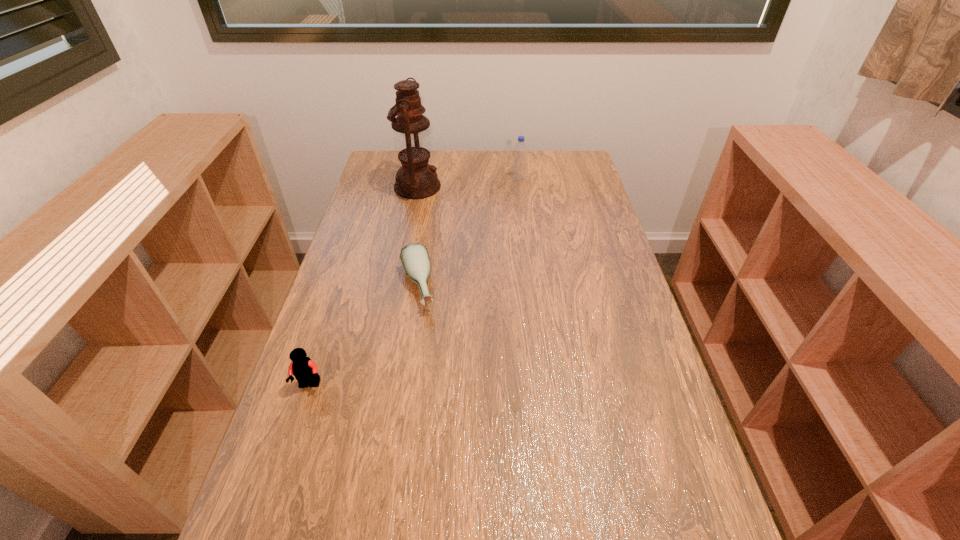
Where is `free space that satisfies the following two spatial constraints: 1. on the back side of the left bottle; 2. on the left side of the third shortest object`? This screenshot has height=540, width=960. free space that satisfies the following two spatial constraints: 1. on the back side of the left bottle; 2. on the left side of the third shortest object is located at coordinates (433, 179).